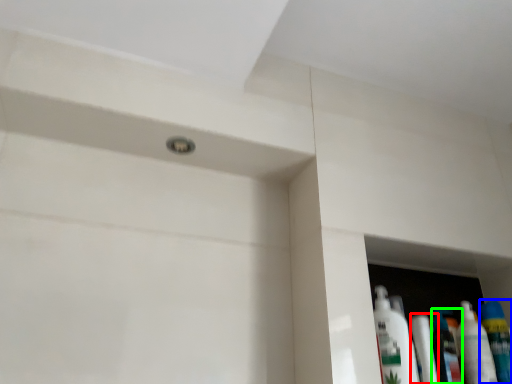
Question: Considering the real-world distances, which object is farthest from toiletry (highlighted by a red box)? mouthwash (highlighted by a blue box) or mouthwash (highlighted by a green box)?

Choices:
 (A) mouthwash
 (B) mouthwash

Answer: (A)